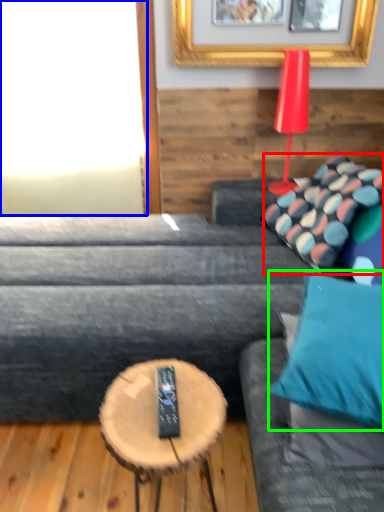
Question: Which object is positioned farthest from pillow (highlighted by a red box)? Select from window (highlighted by a blue box) and pillow (highlighted by a green box).

Choices:
 (A) window
 (B) pillow

Answer: (A)